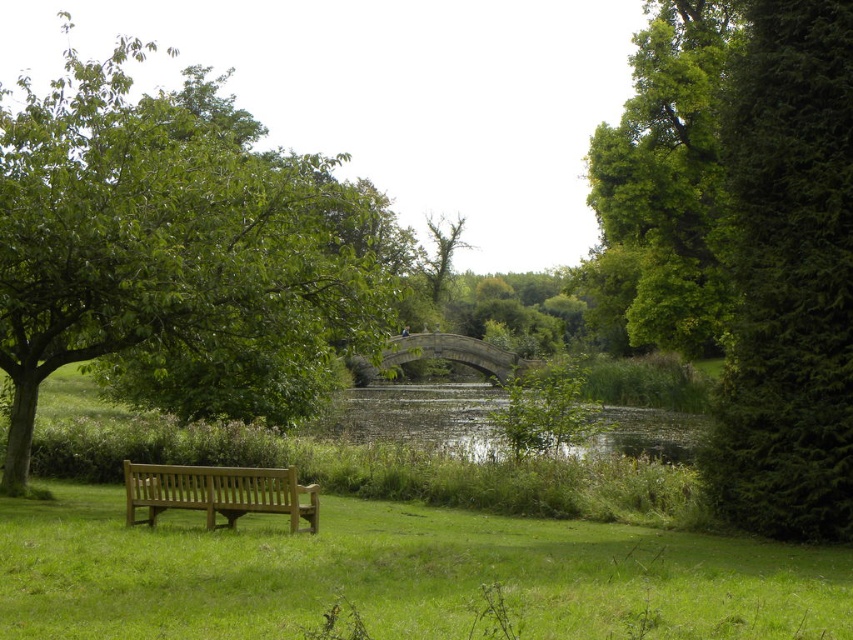
Is green leafy tree at left positioned at the back of bare wood tree at center?

No, green leafy tree at left is in front of bare wood tree at center.

Consider the image. Can you confirm if green leafy tree at left is shorter than bare wood tree at center?

Incorrect, green leafy tree at left's height does not fall short of bare wood tree at center's.

At what (x,y) coordinates should I click in order to perform the action: click on green leafy tree at left. Please return your answer as a coordinate pair (x, y). This screenshot has width=853, height=640. Looking at the image, I should click on (165, 230).

What are the coordinates of `green leafy tree at left` in the screenshot? It's located at (165, 230).

Between green grass at lower left and bare wood tree at center, which one has less height?

With less height is green grass at lower left.

Is point (149, 561) farther from viewer compared to point (440, 280)?

No, it is not.

Identify the location of green grass at lower left. This screenshot has width=853, height=640. (397, 576).

Is green leafy tree at left below green leafy tree at upper right?

Incorrect, green leafy tree at left is not positioned below green leafy tree at upper right.

Consider the image. Does green leafy tree at left have a larger size compared to green leafy tree at upper right?

Yes.

Is point (294, 269) positioned after point (712, 68)?

No, it is in front of (712, 68).

Locate an element on the screen. This screenshot has width=853, height=640. green leafy tree at left is located at coordinates (165, 230).